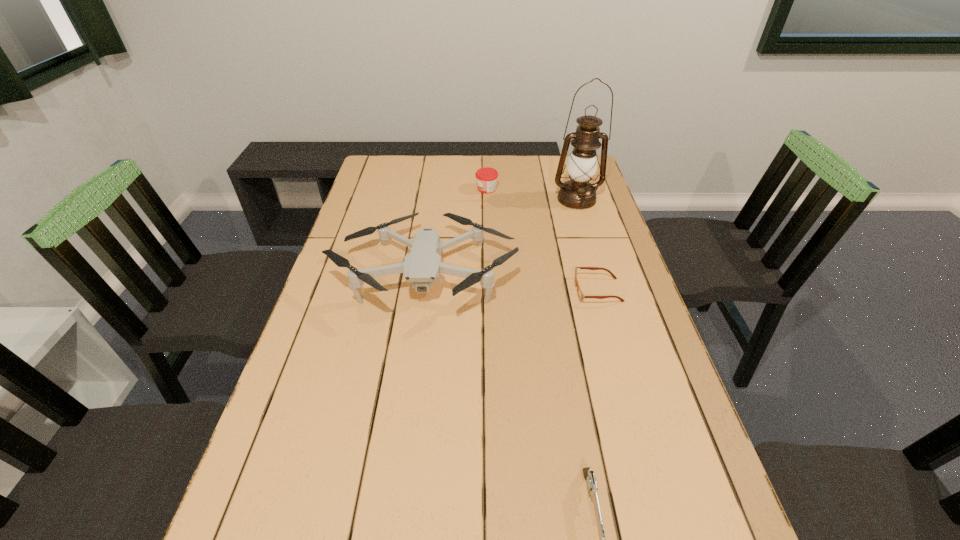
Where is `the tallest object`? The width and height of the screenshot is (960, 540). the tallest object is located at coordinates click(x=578, y=193).

The width and height of the screenshot is (960, 540). Find the location of `the second tallest object`. the second tallest object is located at coordinates (422, 266).

At what (x,y) coordinates should I click in order to perform the action: click on jam. Please return your answer as a coordinate pair (x, y). This screenshot has width=960, height=540. Looking at the image, I should click on (486, 177).

You are a GUI agent. You are given a task and a screenshot of the screen. Output one action in this format:
    pyautogui.click(x=<x>, y=<y>)
    Task: Click on the shortest object
    
    Given the screenshot: What is the action you would take?
    pyautogui.click(x=581, y=296)

I want to click on vacant position located on the left of the oil lamp, so click(x=482, y=199).

Identify the location of vacant region located 0.370m with a camera at the front of the second tallest object. (397, 476).

Where is `vacant space located on the label side of the third tallest object`? The width and height of the screenshot is (960, 540). vacant space located on the label side of the third tallest object is located at coordinates (445, 189).

The image size is (960, 540). In order to click on vacant point located 0.240m on the label side of the third tallest object in this screenshot , I will do `click(410, 189)`.

Find the location of a particular element. The image size is (960, 540). vacant space located on the label side of the third tallest object is located at coordinates (434, 189).

At what (x,y) coordinates should I click in order to perform the action: click on vacant area situated 0.160m on the front-facing side of the shortest object. Please return your answer as a coordinate pair (x, y). The height and width of the screenshot is (540, 960). Looking at the image, I should click on (516, 291).